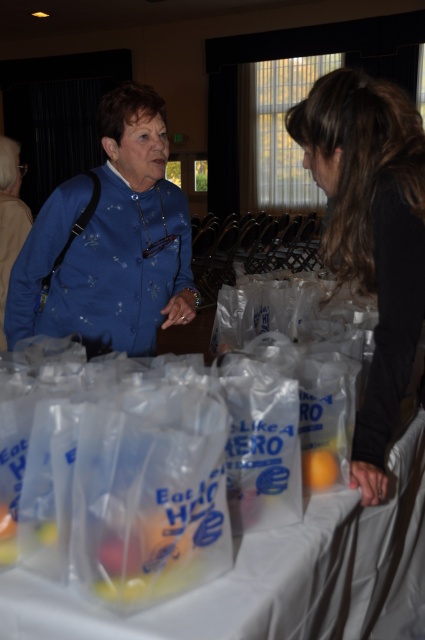
You are standing in front of the table with the white cloth and plastic bags. There are two points marked in the image. Point A is at coordinates point (59, 300) and Point B is at point (11, 160). Which point is closer to you?

Point A at point (59, 300) is closer to the camera than point B at point (11, 160).

You are standing at the point with coordinates point (337, 470). A friend is at point (53, 205). If you want to walk directly towards your friend, which direction should you move?

Since point (53, 205) is behind point (337, 470), you should move backward to reach your friend at point (53, 205).